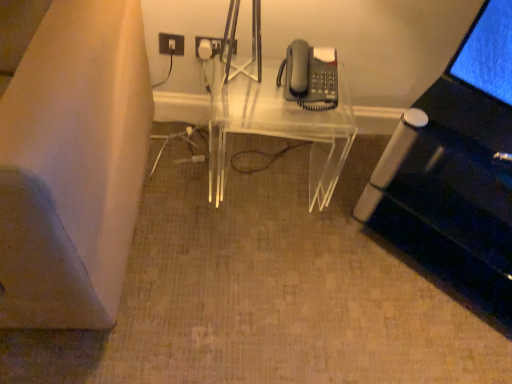
Question: Is white plastic electrical outlet at upper center positioned with its back to matte gray phone at upper right?

Choices:
 (A) no
 (B) yes

Answer: (A)

Question: From a real-world perspective, is white plastic electrical outlet at upper center below matte gray phone at upper right?

Choices:
 (A) no
 (B) yes

Answer: (B)

Question: Considering the relative positions of white plastic electrical outlet at upper center and matte gray phone at upper right in the image provided, is white plastic electrical outlet at upper center to the right of matte gray phone at upper right from the viewer's perspective?

Choices:
 (A) no
 (B) yes

Answer: (A)

Question: From a real-world perspective, is white plastic electrical outlet at upper center on top of matte gray phone at upper right?

Choices:
 (A) no
 (B) yes

Answer: (A)

Question: Is white plastic electrical outlet at upper center smaller than matte gray phone at upper right?

Choices:
 (A) yes
 (B) no

Answer: (A)

Question: Is white plastic electrical outlet at upper center far away from matte gray phone at upper right?

Choices:
 (A) yes
 (B) no

Answer: (B)

Question: Considering the relative sizes of matte gray phone at upper right and white plastic electrical outlet at upper center in the image provided, is matte gray phone at upper right thinner than white plastic electrical outlet at upper center?

Choices:
 (A) yes
 (B) no

Answer: (B)

Question: Can you confirm if matte gray phone at upper right is wider than white plastic electrical outlet at upper center?

Choices:
 (A) no
 (B) yes

Answer: (B)

Question: Is the depth of matte gray phone at upper right less than that of white plastic electrical outlet at upper center?

Choices:
 (A) yes
 (B) no

Answer: (A)

Question: Considering the relative sizes of matte gray phone at upper right and white plastic electrical outlet at upper center in the image provided, is matte gray phone at upper right smaller than white plastic electrical outlet at upper center?

Choices:
 (A) yes
 (B) no

Answer: (B)

Question: Can you confirm if matte gray phone at upper right is bigger than white plastic electrical outlet at upper center?

Choices:
 (A) no
 (B) yes

Answer: (B)

Question: Can you confirm if matte gray phone at upper right is positioned to the left of white plastic electrical outlet at upper center?

Choices:
 (A) no
 (B) yes

Answer: (A)

Question: Is white plastic electrical outlet at upper center bigger than transparent acrylic table at center?

Choices:
 (A) yes
 (B) no

Answer: (B)